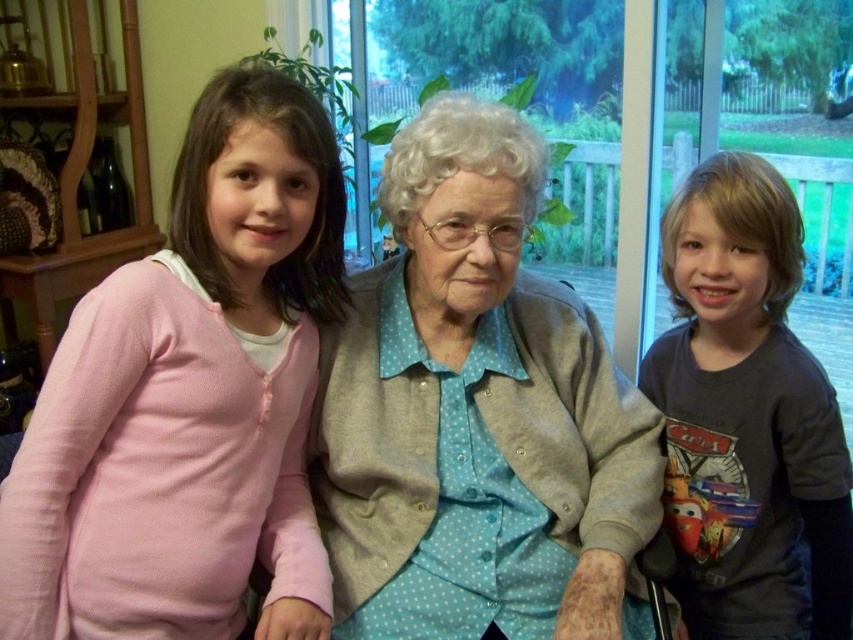
Is light blue dotted fabric at center taller than dark gray t-shirt at right?

In fact, light blue dotted fabric at center may be shorter than dark gray t-shirt at right.

Is light blue dotted fabric at center bigger than dark gray t-shirt at right?

Indeed, light blue dotted fabric at center has a larger size compared to dark gray t-shirt at right.

This screenshot has height=640, width=853. Describe the element at coordinates (476, 413) in the screenshot. I see `light blue dotted fabric at center` at that location.

The height and width of the screenshot is (640, 853). Find the location of `light blue dotted fabric at center`. light blue dotted fabric at center is located at coordinates (476, 413).

In the scene shown: Is pink cotton sweater at left taller than dark gray t-shirt at right?

No, pink cotton sweater at left is not taller than dark gray t-shirt at right.

Which is in front, point (108, 435) or point (759, 355)?

Point (108, 435)

Find the location of a particular element. This screenshot has height=640, width=853. pink cotton sweater at left is located at coordinates (190, 400).

What do you see at coordinates (190, 400) in the screenshot? The height and width of the screenshot is (640, 853). I see `pink cotton sweater at left` at bounding box center [190, 400].

Does pink cotton sweater at left appear on the left side of light blue dotted fabric at center?

Correct, you'll find pink cotton sweater at left to the left of light blue dotted fabric at center.

Identify the location of pink cotton sweater at left. Image resolution: width=853 pixels, height=640 pixels. (190, 400).

Locate an element on the screen. pink cotton sweater at left is located at coordinates (190, 400).